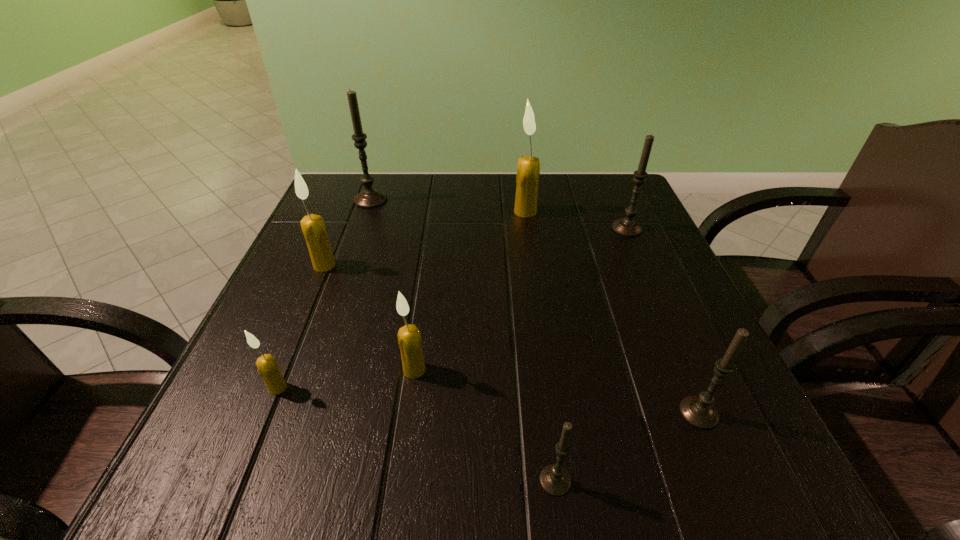
This screenshot has width=960, height=540. What are the coordinates of `free spot between the third farthest object and the third nearest cream candle` in the screenshot? It's located at (476, 247).

Locate an element on the screen. vacant region between the seventh farthest candle and the fourth farthest candle is located at coordinates (512, 339).

This screenshot has height=540, width=960. In order to click on vacant region between the third biggest gray candle and the third farthest cream candle in this screenshot , I will do `click(557, 391)`.

Point out which object is positioned as the sixth nearest to the farthest gray candle. Please provide its 2D coordinates. Your answer should be formatted as a tuple, i.e. [(x, y)], where the tuple contains the x and y coordinates of a point satisfying the conditions above.

[(555, 480)]

At what (x,y) coordinates should I click in order to perform the action: click on the seventh closest object relative to the farthest cream candle. Please return your answer as a coordinate pair (x, y). Looking at the image, I should click on (266, 364).

This screenshot has width=960, height=540. Find the location of `the second closest candle to the smallest cream candle`. the second closest candle to the smallest cream candle is located at coordinates (313, 226).

Identify the location of candle that is the sixth closest to the rightmost cream candle. Image resolution: width=960 pixels, height=540 pixels. (555, 480).

Locate an element on the screen. Image resolution: width=960 pixels, height=540 pixels. the closest cream candle to the nearest candle is located at coordinates (409, 337).

Choose which cream candle is the nearest neighbor to the sixth nearest object. Please provide its 2D coordinates. Your answer should be formatted as a tuple, i.e. [(x, y)], where the tuple contains the x and y coordinates of a point satisfying the conditions above.

[(528, 170)]

Find the location of a particular element. This screenshot has height=540, width=960. the second closest gray candle to the second nearest gray candle is located at coordinates (627, 226).